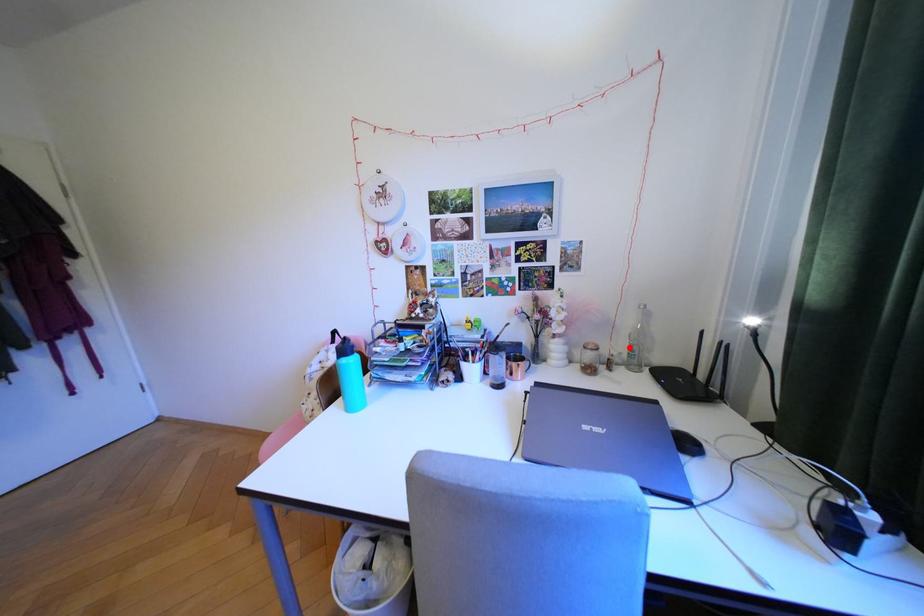
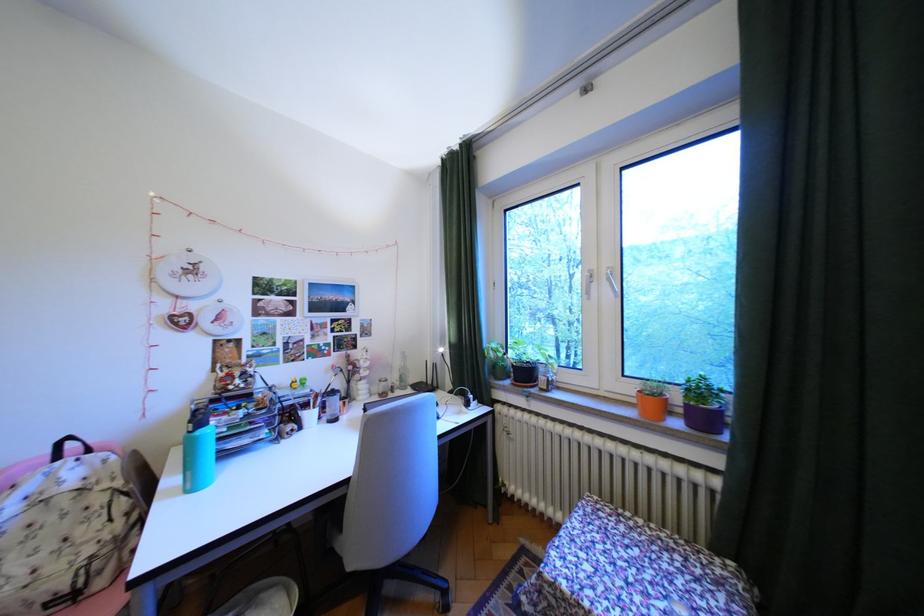
Question: I am providing you with two images of the same scene from different viewpoints. Given a red point in image1, look at the same physical point in image2. Is it:

Choices:
 (A) Closer to the viewpoint
 (B) Farther from the viewpoint

Answer: (A)